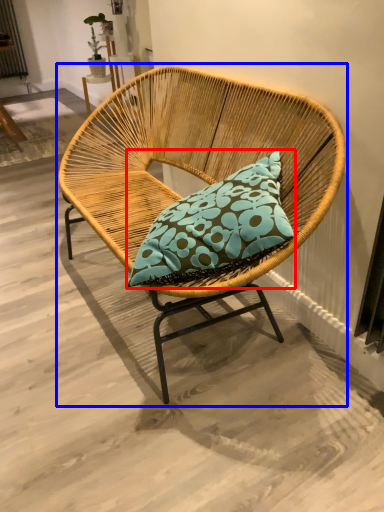
Question: Which object appears farthest to the camera in this image, pillow (highlighted by a red box) or chair (highlighted by a blue box)?

Choices:
 (A) pillow
 (B) chair

Answer: (A)